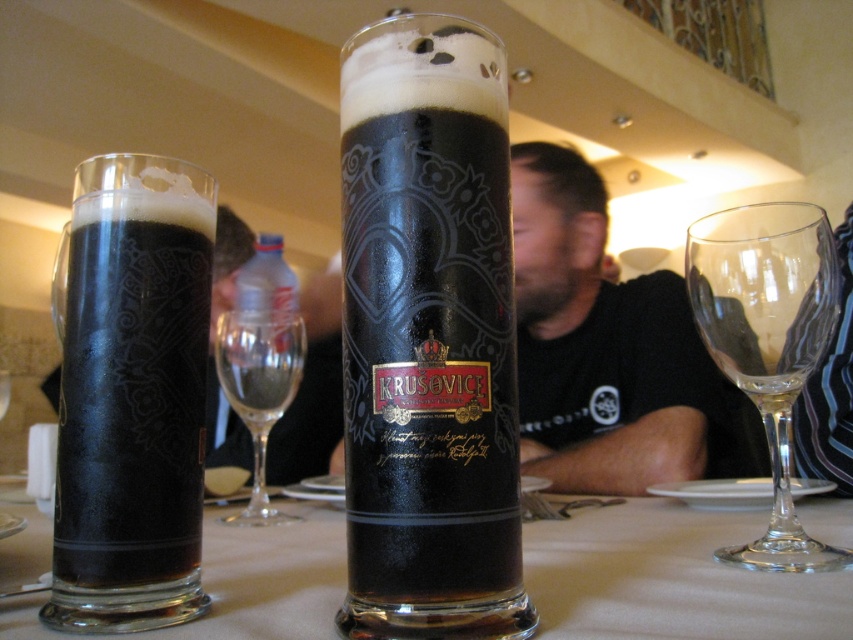
Question: Among these objects, which one is farthest from the camera?

Choices:
 (A) dark glass beer at center
 (B) dark glass beer at left

Answer: (B)

Question: Which point is farther to the camera?

Choices:
 (A) dark glass beer at left
 (B) transparent glass at right
 (C) black t-shirt at center

Answer: (C)

Question: Among these points, which one is farthest from the camera?

Choices:
 (A) (320, 636)
 (B) (247, 417)

Answer: (B)

Question: Does translucent glass beer at center lie in front of transparent glass at right?

Choices:
 (A) no
 (B) yes

Answer: (B)

Question: In this image, where is dark glass beer at left located relative to transparent glass at right?

Choices:
 (A) below
 (B) above

Answer: (B)

Question: Where is dark glass beer at left located in relation to black t-shirt at center in the image?

Choices:
 (A) left
 (B) right

Answer: (A)